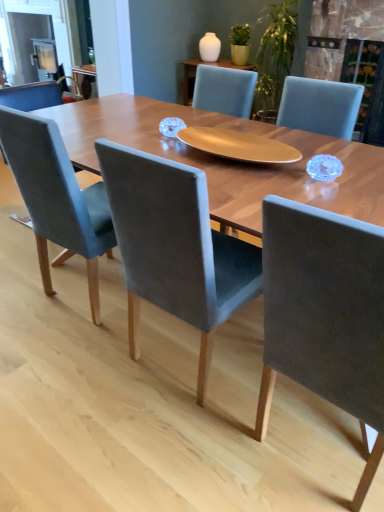
I want to click on vacant region in front of velvet grey chair at center, marked as the second chair in a left-to-right arrangement, so click(x=173, y=445).